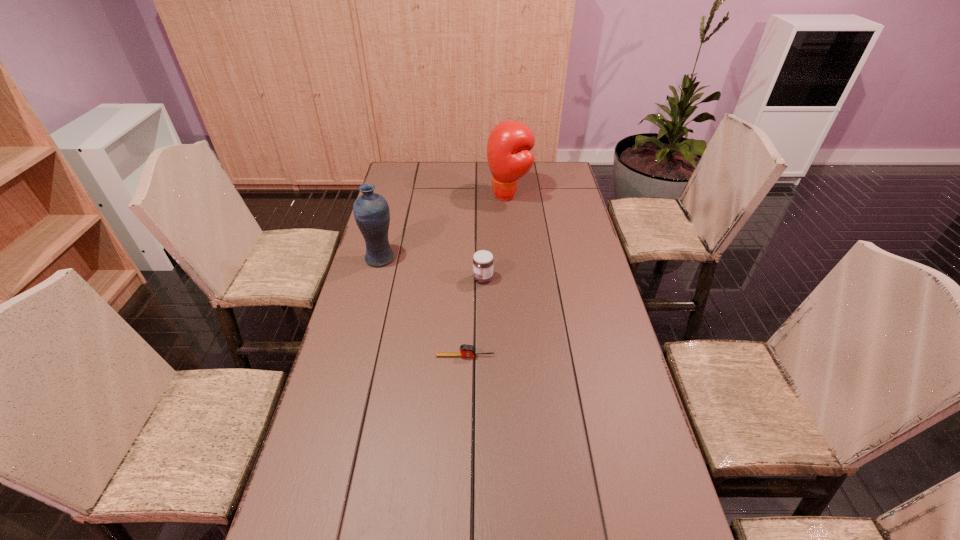
Identify the location of vacant space located on the back of the vase. The width and height of the screenshot is (960, 540). (394, 208).

Find the location of a particular element. The image size is (960, 540). free space located 0.320m on the front label of the third tallest object is located at coordinates (380, 278).

The height and width of the screenshot is (540, 960). I want to click on vacant position located on the front label of the third tallest object, so click(x=372, y=278).

You are a GUI agent. You are given a task and a screenshot of the screen. Output one action in this format:
    pyautogui.click(x=<x>, y=<y>)
    Task: Click on the vacant area situated on the front label of the third tallest object
    
    Given the screenshot: What is the action you would take?
    pyautogui.click(x=377, y=278)

Locate an element on the screen. The height and width of the screenshot is (540, 960). vacant space located 0.260m on the right of the tape measure is located at coordinates (584, 356).

At what (x,y) coordinates should I click in order to perform the action: click on object located in the far edge section of the desktop. Please return your answer as a coordinate pair (x, y). Looking at the image, I should click on (509, 146).

The height and width of the screenshot is (540, 960). Identify the location of object that is at the left edge. click(x=371, y=211).

The height and width of the screenshot is (540, 960). In the image, there is a desktop. Identify the location of free region at the far edge. (519, 186).

Locate an element on the screen. This screenshot has width=960, height=540. free point at the left edge is located at coordinates (378, 332).

Locate an element on the screen. free space at the right edge is located at coordinates (595, 377).